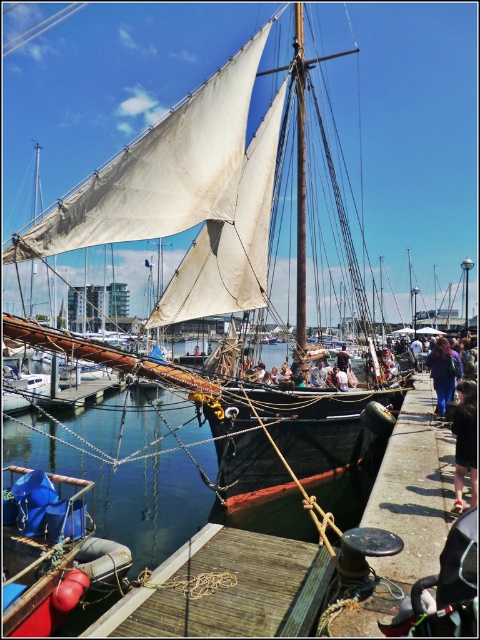
Question: Which of the following is the closest to the observer?

Choices:
 (A) (300, 188)
 (B) (74, 49)
 (C) (348, 358)

Answer: (A)

Question: Does blue fabric bag at lower left appear under black fabric person at lower right?

Choices:
 (A) yes
 (B) no

Answer: (A)

Question: Based on their relative distances, which object is farther from the blue fabric bag at lower left?

Choices:
 (A) smooth wood mast at center
 (B) black fabric person at lower right
 (C) light brown leather jacket at center
 (D) wooden at lower center

Answer: (C)

Question: Can you confirm if blue fabric bag at lower left is positioned above smooth wood mast at center?

Choices:
 (A) yes
 (B) no

Answer: (B)

Question: Is smooth wood mast at center bigger than blue fabric at lower right?

Choices:
 (A) yes
 (B) no

Answer: (B)

Question: Which point appears closest to the camera in this image?

Choices:
 (A) (444, 380)
 (B) (79, 588)
 (C) (295, 556)
 (D) (304, 259)

Answer: (B)